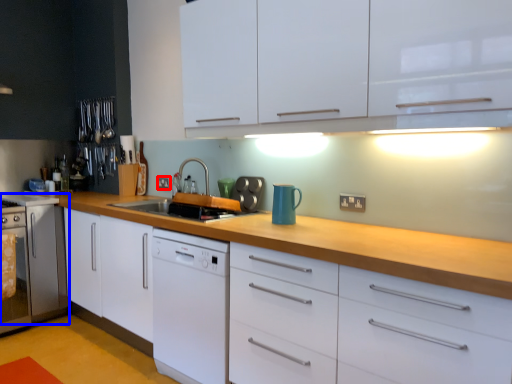
Question: Among these objects, which one is farthest to the camera, electric outlet (highlighted by a red box) or appliance (highlighted by a blue box)?

Choices:
 (A) electric outlet
 (B) appliance

Answer: (A)